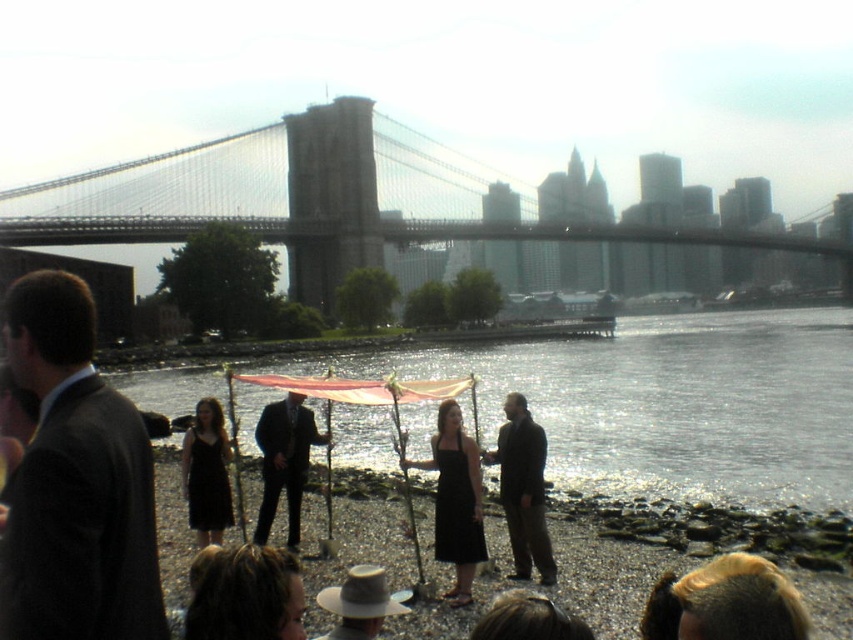
Question: Can you confirm if dark suit at left is positioned to the right of matte black dress at center?

Choices:
 (A) yes
 (B) no

Answer: (B)

Question: Can you confirm if stone bridge at center is smaller than dark suit at left?

Choices:
 (A) no
 (B) yes

Answer: (A)

Question: From the image, what is the correct spatial relationship of brown hair at lower center in relation to dark brown suit at center?

Choices:
 (A) above
 (B) below

Answer: (B)

Question: Which object is farther from the camera taking this photo?

Choices:
 (A) matte black suit at center
 (B) reflective glass water at center

Answer: (B)

Question: Which object is farther from the camera taking this photo?

Choices:
 (A) stone bridge at center
 (B) brown felt hat at lower center
 (C) blonde hair at lower center
 (D) black satin dress at center

Answer: (A)

Question: Which of the following is the farthest from the observer?

Choices:
 (A) (363, 589)
 (B) (532, 602)
 (C) (35, 605)
 (D) (109, 205)

Answer: (D)